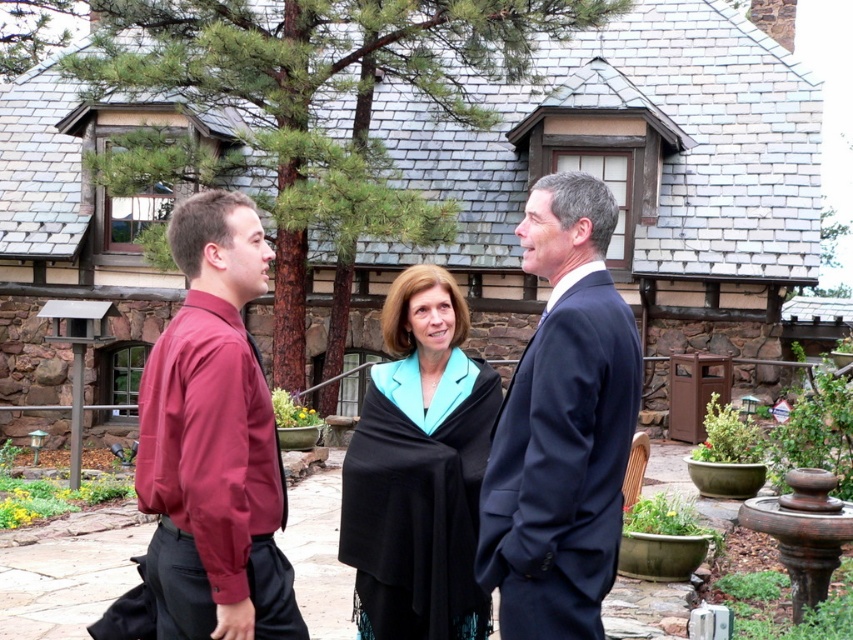
Based on the photo, you are organizing a clothing donation drive and need to determine which items can fit into a narrow storage box. The box can only accommodate items that are less than 5 cm thick. You have the maroon fabric shirt at left and the black woolen shawl at center. Based on their thickness, which item is suitable for the box?

The maroon fabric shirt at left is thinner than the black woolen shawl at center, so the maroon fabric shirt at left can fit into the storage box since it is less than 5 cm thick.

You are a photographer trying to capture a group photo of the maroon fabric shirt at left and the black woolen shawl at center. The camera you are using has a minimum focus distance of 6 feet. Will you be able to focus on both subjects clearly without moving either of them?

The maroon fabric shirt at left and black woolen shawl at center are 6.16 feet apart. Since the minimum focus distance is 6 feet, the camera can focus on both subjects clearly as the distance between them is slightly more than the required minimum focus distance.